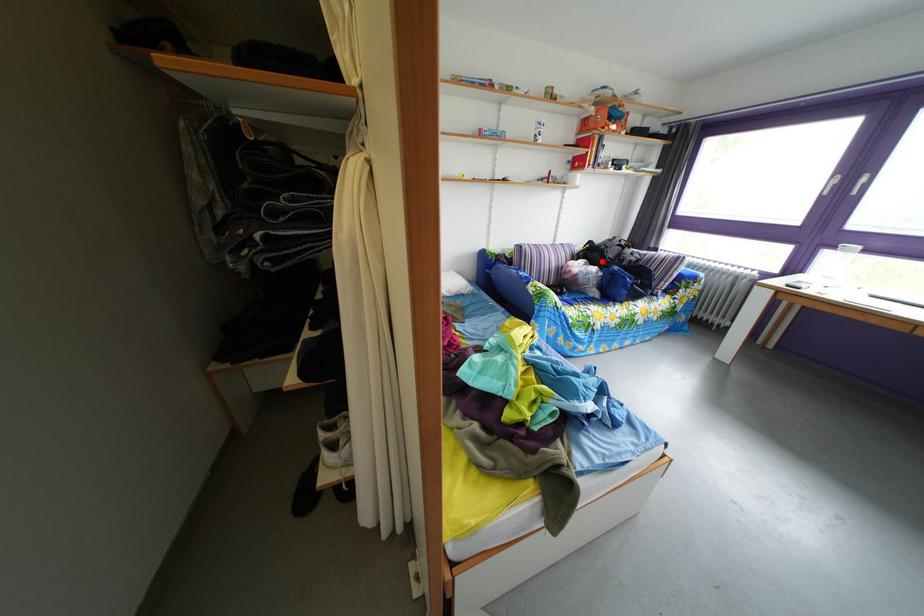
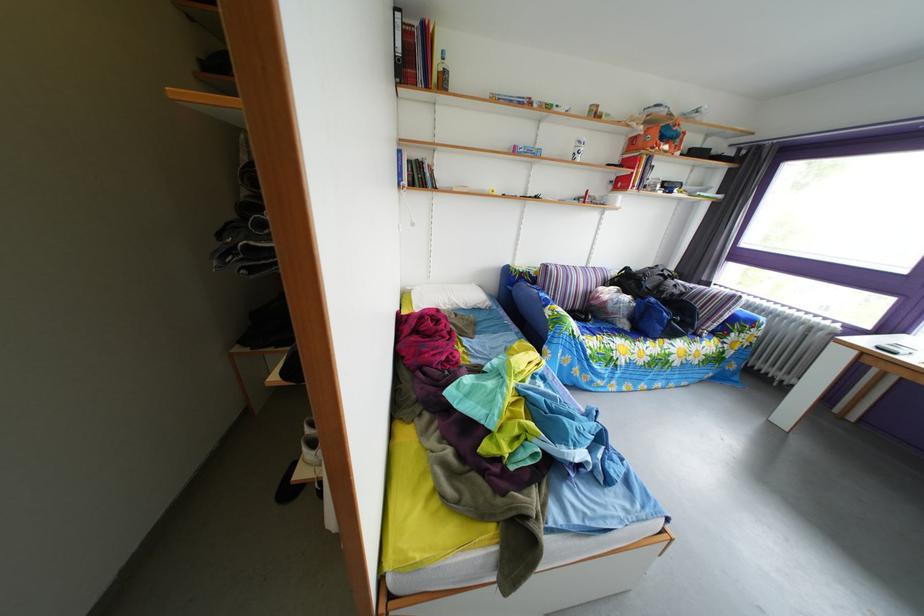
Locate, in the second image, the point that corresponds to the highlighted location in the first image.

(638, 289)